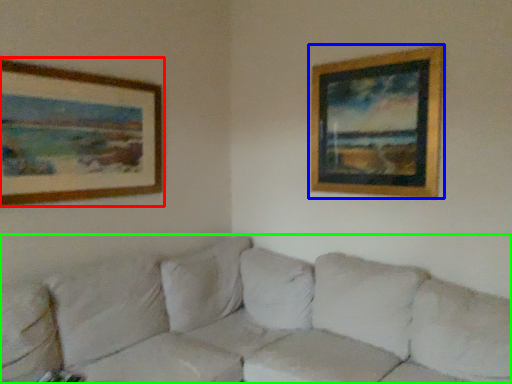
Question: Which object is the closest to the picture frame (highlighted by a red box)? Choose among these: picture frame (highlighted by a blue box) or studio couch (highlighted by a green box).

Choices:
 (A) picture frame
 (B) studio couch

Answer: (B)